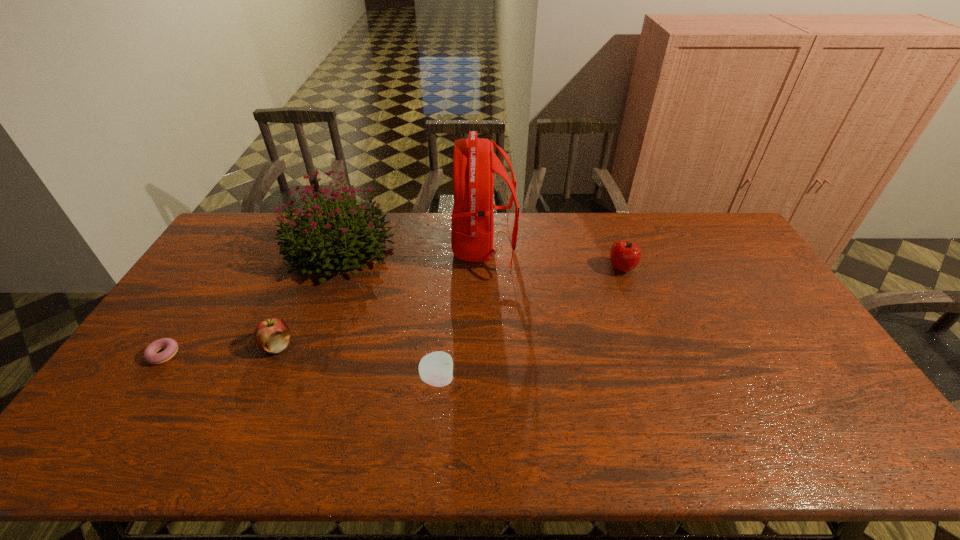
The width and height of the screenshot is (960, 540). Find the location of `blank space at the near edge`. blank space at the near edge is located at coordinates (295, 430).

In the image, there is a desktop. Identify the location of free space at the left edge. This screenshot has width=960, height=540. (181, 373).

Find the location of a particular element. The width and height of the screenshot is (960, 540). free location at the right edge of the desktop is located at coordinates (792, 326).

This screenshot has height=540, width=960. Identify the location of vacant region between the fourth shortest object and the backpack. (553, 258).

Image resolution: width=960 pixels, height=540 pixels. In order to click on empty location between the tallest object and the fifth shortest object in this screenshot , I will do `click(412, 248)`.

The image size is (960, 540). I want to click on free point between the backpack and the bouquet, so click(x=412, y=248).

This screenshot has width=960, height=540. Identify the location of vacant space that's between the second nearest apple and the tallest apple. (449, 307).

Find the location of a particular element. Image resolution: width=960 pixels, height=540 pixels. unoccupied area between the fourth shortest object and the nearest apple is located at coordinates (530, 323).

You are a GUI agent. You are given a task and a screenshot of the screen. Output one action in this format:
    pyautogui.click(x=<x>, y=<y>)
    Task: Click on the free space that is in between the leftmost object and the second apple from right to left
    Image resolution: width=960 pixels, height=540 pixels.
    Given the screenshot: What is the action you would take?
    pyautogui.click(x=300, y=367)

This screenshot has width=960, height=540. Find the location of `vacant region between the nearest apple and the leftmost object`. vacant region between the nearest apple and the leftmost object is located at coordinates (300, 367).